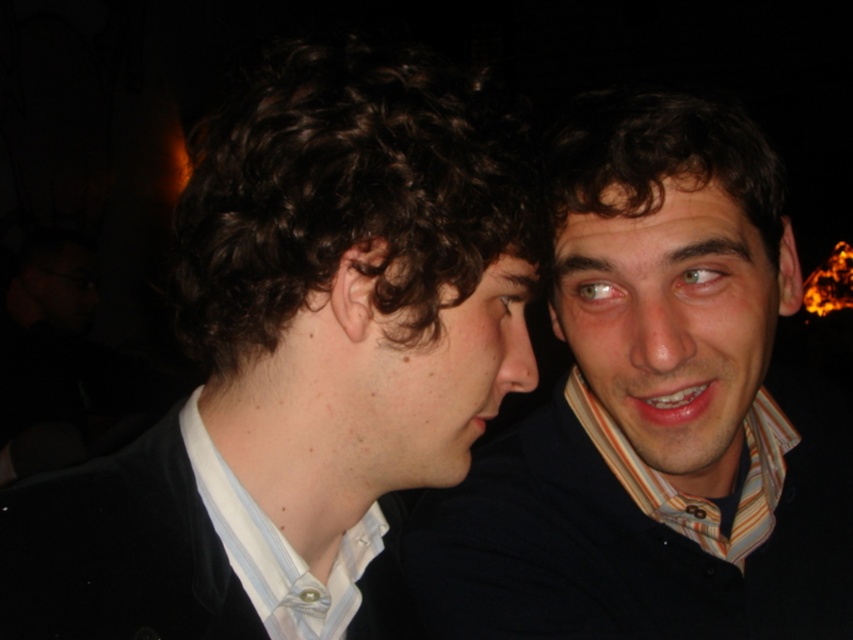
From the picture: Is matte black suit at left further to the viewer compared to matte black shirt at center?

No.

Between point (282, 513) and point (763, 541), which one is positioned in front?

Point (282, 513) is in front.

You are a GUI agent. You are given a task and a screenshot of the screen. Output one action in this format:
    pyautogui.click(x=<x>, y=<y>)
    Task: Click on the matte black suit at left
    
    Given the screenshot: What is the action you would take?
    pyautogui.click(x=300, y=364)